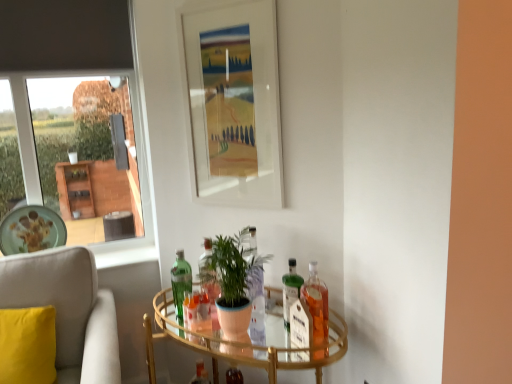
The height and width of the screenshot is (384, 512). I want to click on green glass bottle at center, which is the first bottle in left-to-right order, so 180,281.

Describe the element at coordinates (68, 310) in the screenshot. The image size is (512, 384). I see `soft beige fabric chair at left` at that location.

Find the location of `translucent glass bottle at center, which is the first bottle from back to front`. translucent glass bottle at center, which is the first bottle from back to front is located at coordinates (200, 374).

In order to face green matte plant at center, should I rotate leftwards or rightwards?

Rotate left and turn 3.816 degrees.

Find the location of `green glass bottle at center, the 4th bottle when ordered from right to left`. green glass bottle at center, the 4th bottle when ordered from right to left is located at coordinates (180, 281).

Find the location of a particular element. houseplant above the clear glass table at center (from a real-world perspective) is located at coordinates click(234, 279).

Based on the photo, does green matte plant at center have a lesser height compared to clear glass table at center?

Indeed, green matte plant at center has a lesser height compared to clear glass table at center.

From the picture: Is green matte plant at center positioned beyond the bounds of clear glass table at center?

That's correct, green matte plant at center is outside of clear glass table at center.

Considering the positions of objects translucent glass bottle at right, which is the fourth bottle from left to right, and clear glass table at center in the image provided, who is more to the right, translucent glass bottle at right, which is the fourth bottle from left to right, or clear glass table at center?

Positioned to the right is translucent glass bottle at right, which is the fourth bottle from left to right.

From the image's perspective, which object appears higher, translucent glass bottle at right, which is the fourth bottle from left to right, or clear glass table at center?

translucent glass bottle at right, which is the fourth bottle from left to right, appears higher in the image.

Does translucent glass bottle at right, the fourth bottle from the back, touch clear glass table at center?

No, translucent glass bottle at right, the fourth bottle from the back, is not with clear glass table at center.

Considering the relative positions of translucent glass bottle at right, the fourth bottle from the back, and clear glass table at center in the image provided, is translucent glass bottle at right, the fourth bottle from the back, in front of clear glass table at center?

No, translucent glass bottle at right, the fourth bottle from the back, is further to the viewer.

Considering the sizes of objects green glass bottle at center, the 4th bottle when ordered from right to left, and white matte picture frame at upper center in the image provided, who is thinner, green glass bottle at center, the 4th bottle when ordered from right to left, or white matte picture frame at upper center?

Thinner between the two is white matte picture frame at upper center.

This screenshot has width=512, height=384. I want to click on picture frame that appears in front of the green glass bottle at center, acting as the second bottle starting from the back, so click(x=234, y=104).

Which of these two, soft beige fabric chair at left or white matte picture frame at upper center, stands shorter?

soft beige fabric chair at left is shorter.

Can you confirm if soft beige fabric chair at left is wider than white matte picture frame at upper center?

Correct, the width of soft beige fabric chair at left exceeds that of white matte picture frame at upper center.

Considering the points (63, 369) and (274, 128), which point is behind, point (63, 369) or point (274, 128)?

The point (63, 369) is behind.

From the image's perspective, who appears lower, soft beige fabric chair at left or white matte picture frame at upper center?

From the image's view, soft beige fabric chair at left is below.

Considering the relative sizes of translucent glass bottle at center, the fourth bottle from the front, and green glass bottle at center, which is counted as the 3th bottle, starting from the front, in the image provided, is translucent glass bottle at center, the fourth bottle from the front, thinner than green glass bottle at center, which is counted as the 3th bottle, starting from the front,?

Indeed, translucent glass bottle at center, the fourth bottle from the front, has a lesser width compared to green glass bottle at center, which is counted as the 3th bottle, starting from the front.

Is translucent glass bottle at center, the second bottle from the left, turned away from green glass bottle at center, acting as the second bottle starting from the back?

No, green glass bottle at center, acting as the second bottle starting from the back, is not at the back of translucent glass bottle at center, the second bottle from the left.

Is point (210, 382) closer to viewer compared to point (175, 288)?

That is False.

Which of these two, translucent glass bottle at center, which is the first bottle from back to front, or green glass bottle at center, the 4th bottle when ordered from right to left, stands shorter?

translucent glass bottle at center, which is the first bottle from back to front, is shorter.

Is matte ceramic plate at left with soft beige fabric chair at left?

No, matte ceramic plate at left is not in contact with soft beige fabric chair at left.

Between point (42, 230) and point (79, 352), which one is positioned in front?

The point (79, 352) is more forward.

Is matte ceramic plate at left outside of soft beige fabric chair at left?

Absolutely, matte ceramic plate at left is external to soft beige fabric chair at left.

Which is behind, matte ceramic plate at left or soft beige fabric chair at left?

matte ceramic plate at left is further from the camera.

Considering the sizes of white matte picture frame at upper center and clear glass table at center in the image, is white matte picture frame at upper center taller or shorter than clear glass table at center?

Clearly, white matte picture frame at upper center is taller compared to clear glass table at center.

Would you say white matte picture frame at upper center is to the left or to the right of clear glass table at center in the picture?

Based on their positions, white matte picture frame at upper center is located to the left of clear glass table at center.

Could you tell me if white matte picture frame at upper center is turned towards clear glass table at center?

No, white matte picture frame at upper center is not oriented towards clear glass table at center.

Between white matte picture frame at upper center and clear glass table at center, which one has smaller width?

white matte picture frame at upper center.

Where is `houseplant positioned vertically above the clear glass table at center (from a real-world perspective)`? houseplant positioned vertically above the clear glass table at center (from a real-world perspective) is located at coordinates (234, 279).

You are a GUI agent. You are given a task and a screenshot of the screen. Output one action in this format:
    pyautogui.click(x=<x>, y=<y>)
    Task: Click on the 1st bottle behind the clear glass table at center, starting your count from the anchor
    The height and width of the screenshot is (384, 512).
    Given the screenshot: What is the action you would take?
    pyautogui.click(x=317, y=304)

Looking at the image, which one is located further to white matte picture frame at upper center, matte ceramic plate at left or clear glass table at center?

The object further to white matte picture frame at upper center is matte ceramic plate at left.

Looking at the image, which one is located further to green glass bottle at center, arranged as the second bottle when viewed from the front, white matte picture frame at upper center or matte ceramic plate at left?

Among the two, matte ceramic plate at left is located further to green glass bottle at center, arranged as the second bottle when viewed from the front.

Consider the image. From the image, which object appears to be farther from white matte picture frame at upper center, matte ceramic plate at left or soft beige fabric chair at left?

matte ceramic plate at left is positioned further to the anchor white matte picture frame at upper center.

Based on their spatial positions, is clear glass table at center or translucent glass bottle at right, the 1th bottle in the right-to-left sequence, closer to green glass bottle at center, the third bottle viewed from the back?

translucent glass bottle at right, the 1th bottle in the right-to-left sequence, is positioned closer to the anchor green glass bottle at center, the third bottle viewed from the back.

Estimate the real-world distances between objects in this image. Which object is closer to green glass bottle at center, the third bottle viewed from the back, translucent glass bottle at right, the first bottle in the front-to-back sequence, or soft beige fabric chair at left?

translucent glass bottle at right, the first bottle in the front-to-back sequence, lies closer to green glass bottle at center, the third bottle viewed from the back, than the other object.

When comparing their distances from green glass bottle at center, the 4th bottle when ordered from right to left, does translucent glass bottle at right, the first bottle in the front-to-back sequence, or green glass bottle at center, which is counted as the 2th bottle, starting from the right, seem further?

Based on the image, translucent glass bottle at right, the first bottle in the front-to-back sequence, appears to be further to green glass bottle at center, the 4th bottle when ordered from right to left.

When comparing their distances from translucent glass bottle at center, the fourth bottle from the front, does matte ceramic plate at left or green glass bottle at center, the 4th bottle when ordered from right to left, seem further?

matte ceramic plate at left is further to translucent glass bottle at center, the fourth bottle from the front.

When comparing their distances from green matte plant at center, does translucent glass bottle at right, the fourth bottle from the back, or matte ceramic plate at left seem closer?

translucent glass bottle at right, the fourth bottle from the back, lies closer to green matte plant at center than the other object.

The width and height of the screenshot is (512, 384). Find the location of `houseplant between clear glass table at center and translucent glass bottle at center, the second bottle from the left, along the z-axis`. houseplant between clear glass table at center and translucent glass bottle at center, the second bottle from the left, along the z-axis is located at coordinates (234, 279).

Where is `chair between matte ceramic plate at left and green matte plant at center from left to right`? chair between matte ceramic plate at left and green matte plant at center from left to right is located at coordinates (68, 310).

Where is `houseplant between soft beige fabric chair at left and green glass bottle at center, which is counted as the 2th bottle, starting from the right, from left to right`? The width and height of the screenshot is (512, 384). houseplant between soft beige fabric chair at left and green glass bottle at center, which is counted as the 2th bottle, starting from the right, from left to right is located at coordinates (234, 279).

You are a GUI agent. You are given a task and a screenshot of the screen. Output one action in this format:
    pyautogui.click(x=<x>, y=<y>)
    Task: Click on the table between green glass bottle at center, which is counted as the 3th bottle, starting from the front, and green glass bottle at center, placed as the third bottle when sorted from left to right
    
    Given the screenshot: What is the action you would take?
    pyautogui.click(x=244, y=344)